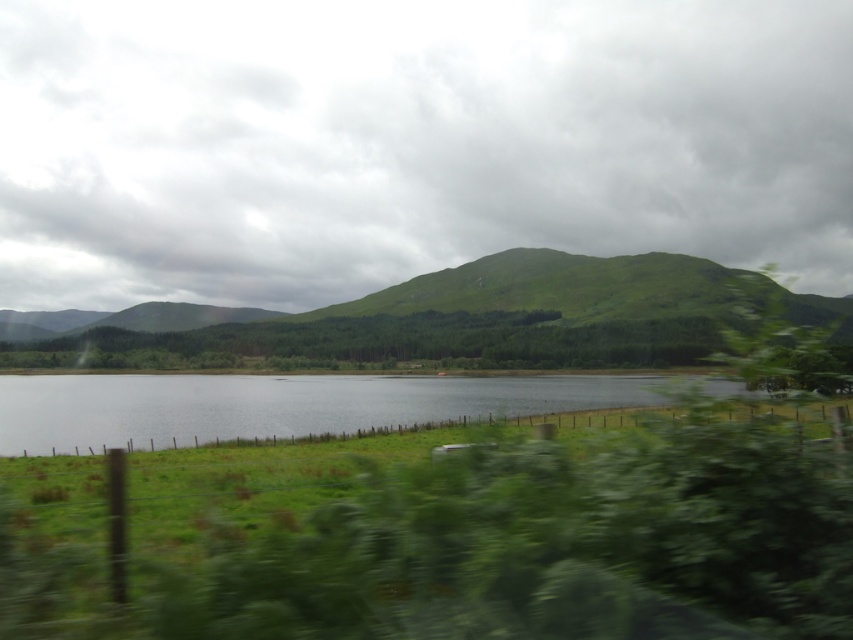
Between point (363, 305) and point (424, 388), which one is positioned in front?

Point (424, 388) is more forward.

Is point (146, 332) positioned after point (279, 378)?

That is True.

The height and width of the screenshot is (640, 853). What do you see at coordinates (436, 321) in the screenshot? I see `green grassy hill at center` at bounding box center [436, 321].

Where is `green grassy hill at center`? green grassy hill at center is located at coordinates (436, 321).